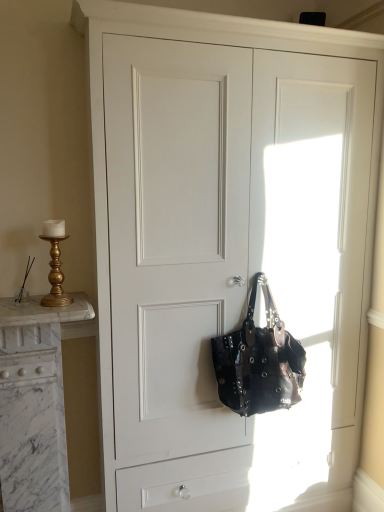
Question: Is gold metallic candlestick at left outside shiny black leather handbag at center?

Choices:
 (A) yes
 (B) no

Answer: (A)

Question: Is gold metallic candlestick at left taller than shiny black leather handbag at center?

Choices:
 (A) yes
 (B) no

Answer: (B)

Question: Is shiny black leather handbag at center inside gold metallic candlestick at left?

Choices:
 (A) yes
 (B) no

Answer: (B)

Question: Does gold metallic candlestick at left have a lesser width compared to shiny black leather handbag at center?

Choices:
 (A) no
 (B) yes

Answer: (B)

Question: Is the depth of gold metallic candlestick at left greater than that of shiny black leather handbag at center?

Choices:
 (A) yes
 (B) no

Answer: (B)

Question: Is gold metallic candlestick at left with shiny black leather handbag at center?

Choices:
 (A) no
 (B) yes

Answer: (A)

Question: Is shiny black leather handbag at center taller than gold metallic candlestick at left?

Choices:
 (A) no
 (B) yes

Answer: (B)

Question: Can you confirm if shiny black leather handbag at center is bigger than gold metallic candlestick at left?

Choices:
 (A) no
 (B) yes

Answer: (B)

Question: From a real-world perspective, is shiny black leather handbag at center beneath gold metallic candlestick at left?

Choices:
 (A) no
 (B) yes

Answer: (B)

Question: Is shiny black leather handbag at center behind gold metallic candlestick at left?

Choices:
 (A) yes
 (B) no

Answer: (A)

Question: Considering the relative sizes of shiny black leather handbag at center and gold metallic candlestick at left in the image provided, is shiny black leather handbag at center smaller than gold metallic candlestick at left?

Choices:
 (A) no
 (B) yes

Answer: (A)

Question: Is shiny black leather handbag at center next to gold metallic candlestick at left?

Choices:
 (A) no
 (B) yes

Answer: (A)

Question: From a real-world perspective, is gold metallic candlestick at left physically located above or below shiny black leather handbag at center?

Choices:
 (A) above
 (B) below

Answer: (A)